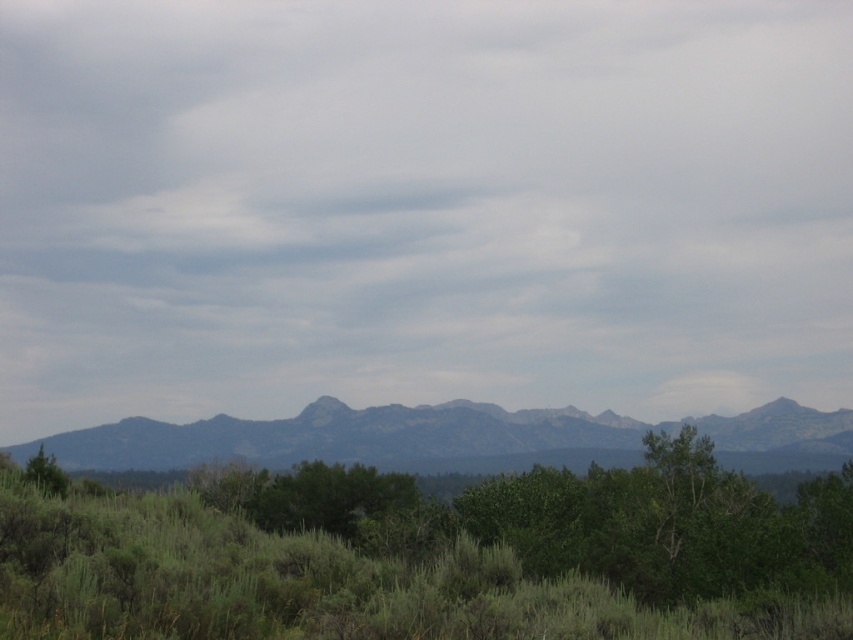
You are an environmental scientist studying the spatial distribution of vegetation in this landscape. You observe the green leafy tree at center and the green matte tree at lower left. Which tree is positioned to the east of the other?

The green leafy tree at center is to the right of the green matte tree at lower left. Assuming the image is oriented with the viewer facing north, the green leafy tree at center would be positioned to the east of the green matte tree at lower left.

You are a photographer standing in the foreground of this landscape scene. You want to capture a photo that includes both the point at coordinates point (517, 433) and point (51, 474). Which point should you focus on to ensure both are in sharp focus?

You should focus on point (51, 474) because it is closer to the camera than point (517, 433). By focusing on the closer point, the depth of field will extend backward, increasing the likelihood that both points are in focus.